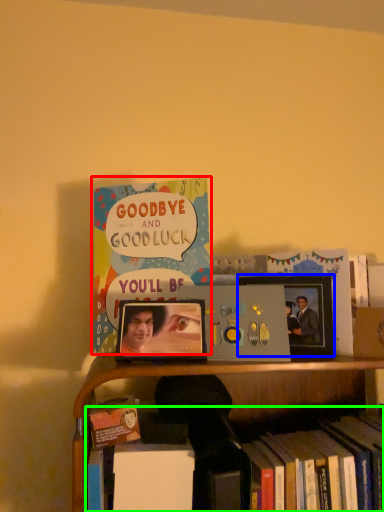
Question: Estimate the real-world distances between objects in this image. Which object is closer to book (highlighted by a red box), picture frame (highlighted by a blue box) or book (highlighted by a green box)?

Choices:
 (A) picture frame
 (B) book

Answer: (A)